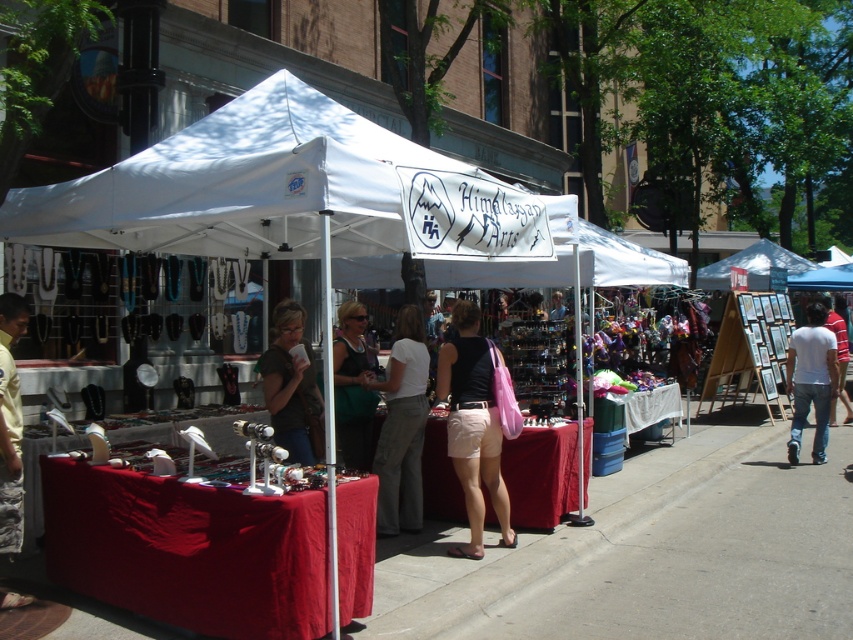
Who is positioned more to the left, yellow fabric bag at lower left or blue fabric canopy at upper center?

yellow fabric bag at lower left is more to the left.

This screenshot has height=640, width=853. I want to click on yellow fabric bag at lower left, so click(x=9, y=413).

Where is `yellow fabric bag at lower left`? This screenshot has width=853, height=640. yellow fabric bag at lower left is located at coordinates (9, 413).

How much distance is there between white fabric canopy at center and pink fabric bag at center?

A distance of 5.13 feet exists between white fabric canopy at center and pink fabric bag at center.

Identify the location of white fabric canopy at center. The width and height of the screenshot is (853, 640). (262, 188).

Locate an element on the screen. white fabric canopy at center is located at coordinates [x=262, y=188].

Is pink fabric bag at center positioned behind light beige pants at center?

No, it is in front of light beige pants at center.

Locate an element on the screen. pink fabric bag at center is located at coordinates (473, 426).

Image resolution: width=853 pixels, height=640 pixels. Describe the element at coordinates (473, 426) in the screenshot. I see `pink fabric bag at center` at that location.

At what (x,y) coordinates should I click in order to perform the action: click on pink fabric bag at center. Please return your answer as a coordinate pair (x, y). The width and height of the screenshot is (853, 640). Looking at the image, I should click on (473, 426).